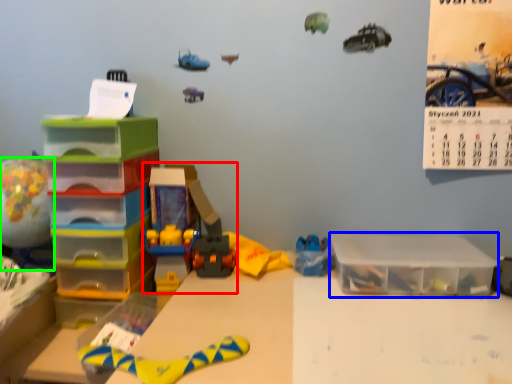
Question: Considering the real-world distances, which object is closest to toy (highlighted by a red box)? storage box (highlighted by a blue box) or toy (highlighted by a green box).

Choices:
 (A) storage box
 (B) toy

Answer: (B)